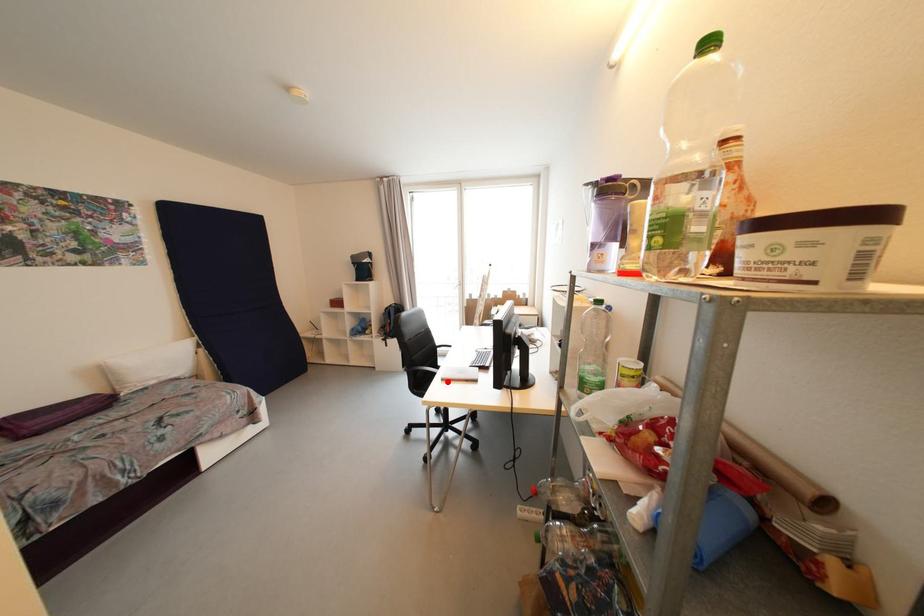
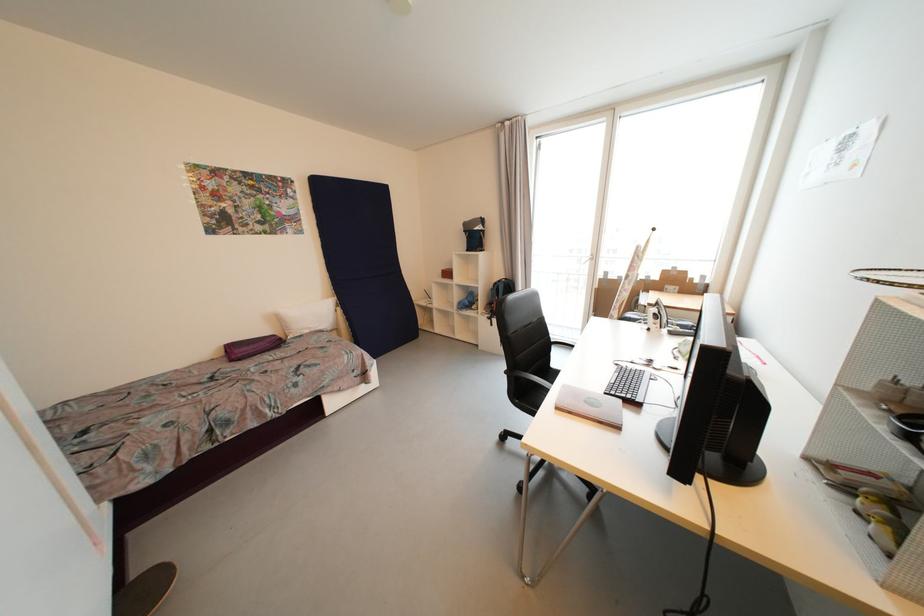
Locate, in the second image, the point that corresponds to the highlighted location in the first image.

(562, 410)